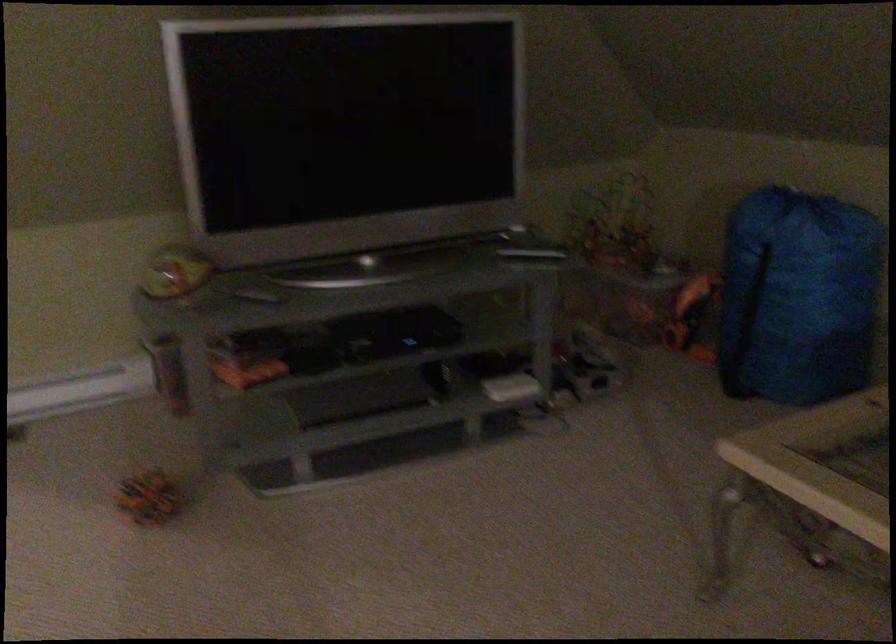
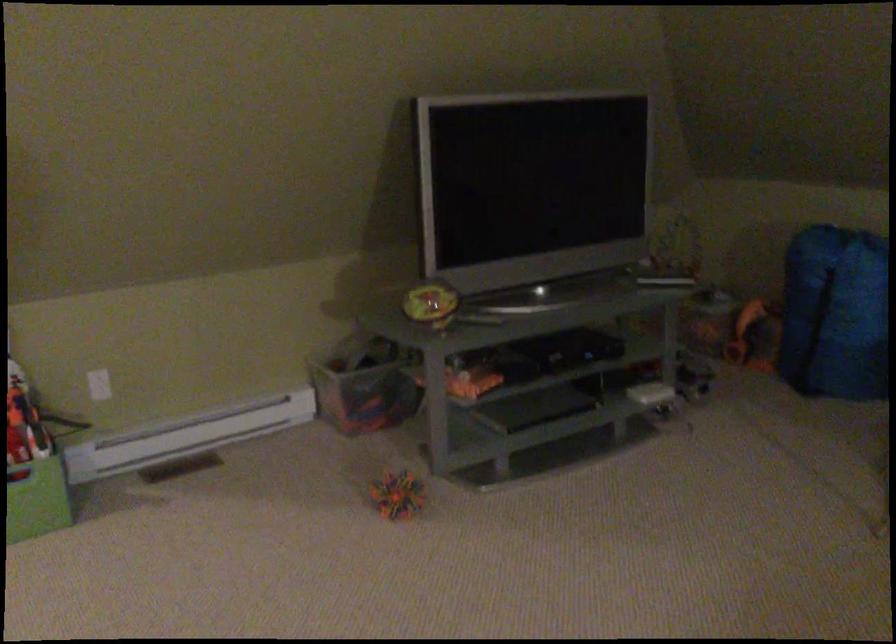
The point at (196, 277) is marked in the first image. Where is the corresponding point in the second image?

(429, 301)